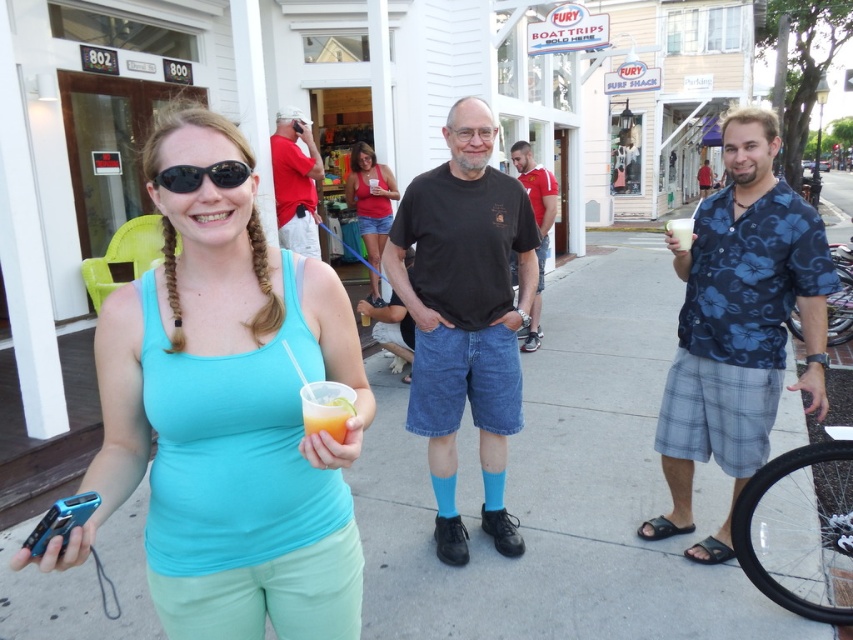
Who is higher up, black cotton t-shirt at center or black matte sunglasses at upper left?

Positioned higher is black matte sunglasses at upper left.

Locate an element on the screen. The height and width of the screenshot is (640, 853). black cotton t-shirt at center is located at coordinates [x=465, y=316].

Which of these two, matte teal tank top at center or blue floral shirt at right, stands shorter?

With less height is matte teal tank top at center.

Where is `matte teal tank top at center`? matte teal tank top at center is located at coordinates (225, 413).

This screenshot has height=640, width=853. Find the location of `matte teal tank top at center`. matte teal tank top at center is located at coordinates (225, 413).

Identify the location of matte teal tank top at center. (225, 413).

Is the position of black cotton t-shirt at center less distant than that of translucent plastic cup at center?

No, black cotton t-shirt at center is further to the viewer.

Does point (457, 545) come behind point (335, 417)?

Yes, it is.

I want to click on black cotton t-shirt at center, so click(x=465, y=316).